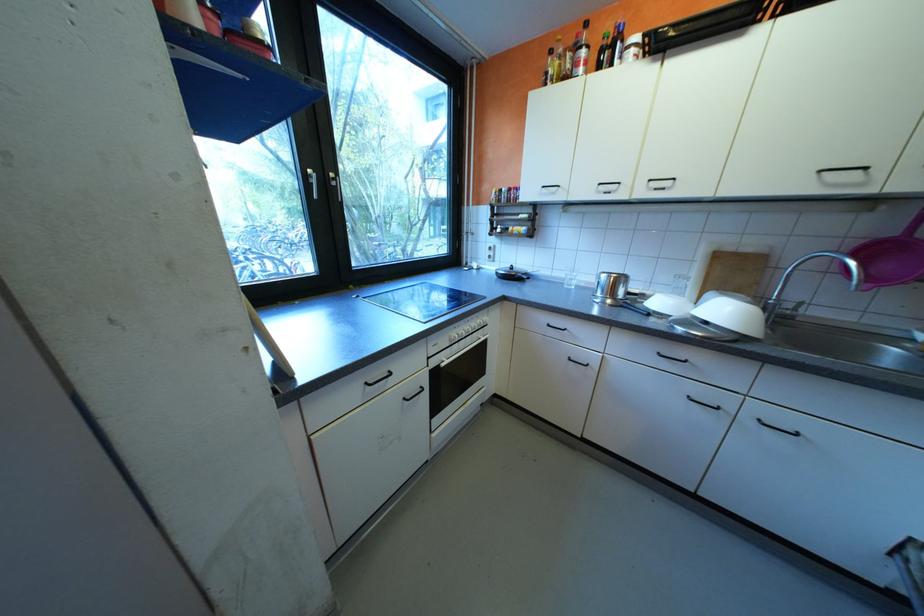
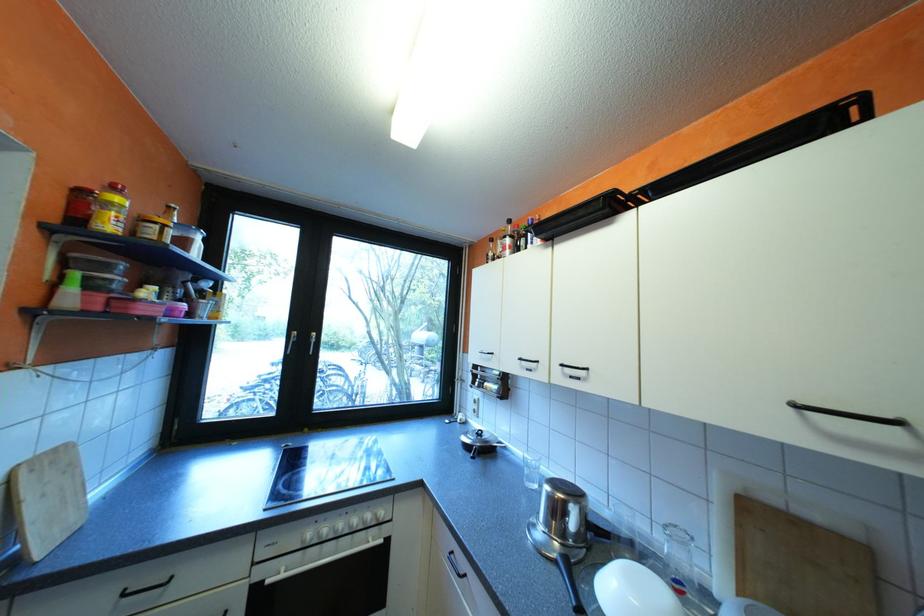
From the picture: How did the camera likely rotate?

The camera's rotation is toward left-up.